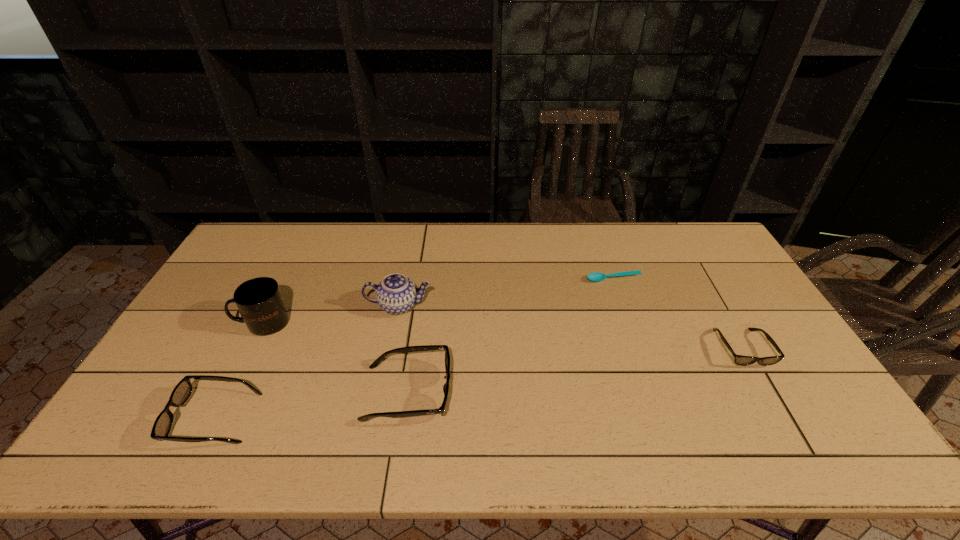
You are a GUI agent. You are given a task and a screenshot of the screen. Output one action in this format:
    pyautogui.click(x=<x>, y=<y>)
    Task: Click on the free space located on the lenses of the second tallest spectacles
    This screenshot has height=540, width=960.
    Given the screenshot: What is the action you would take?
    pyautogui.click(x=127, y=418)

You are a GUI agent. You are given a task and a screenshot of the screen. Output one action in this format:
    pyautogui.click(x=<x>, y=<y>)
    Task: Click on the free space located on the lenses of the second tallest spectacles
    
    Given the screenshot: What is the action you would take?
    pyautogui.click(x=148, y=418)

Locate an element on the screen. Image resolution: width=960 pixels, height=540 pixels. vacant space located 0.100m on the lenses of the second tallest spectacles is located at coordinates (135, 418).

Find the location of a particular element. Image resolution: width=960 pixels, height=540 pixels. vacant region located on the lenses of the tallest spectacles is located at coordinates (557, 393).

Locate an element on the screen. This screenshot has width=960, height=540. vacant space situated on the lenses of the shortest spectacles is located at coordinates (775, 406).

Where is `vacant space located with the handle on the side of the mug`? Image resolution: width=960 pixels, height=540 pixels. vacant space located with the handle on the side of the mug is located at coordinates (221, 322).

Locate an element on the screen. The image size is (960, 540). vacant space located with the handle on the side of the mug is located at coordinates (190, 322).

In order to click on vacant region located 0.170m on the back of the shortest object in this screenshot , I will do `click(602, 244)`.

Image resolution: width=960 pixels, height=540 pixels. Find the location of `vacant space situated at the spout of the chinaware`. vacant space situated at the spout of the chinaware is located at coordinates (377, 416).

Where is `spectacles positioned at the left edge`? This screenshot has height=540, width=960. spectacles positioned at the left edge is located at coordinates (182, 391).